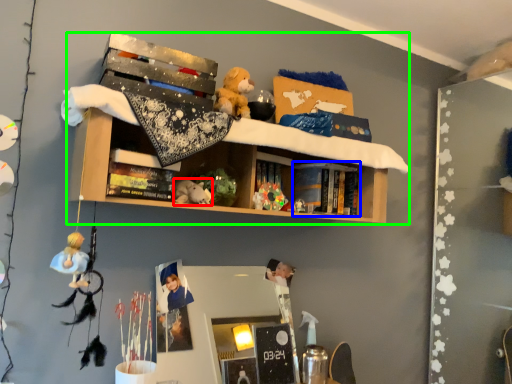
Question: Based on their relative distances, which object is farther from toy (highlighted by a red box)? Choose from book (highlighted by a blue box) and shelf (highlighted by a green box).

Choices:
 (A) book
 (B) shelf

Answer: (A)